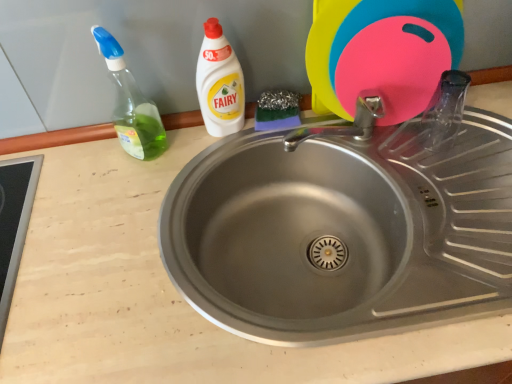
Question: Should I look upward or downward to see stainless steel sink at center?

Choices:
 (A) up
 (B) down

Answer: (B)

Question: Is green translucent bottle at left positioned behind white plastic bottle at upper center?

Choices:
 (A) no
 (B) yes

Answer: (A)

Question: Is green translucent bottle at left located outside white plastic bottle at upper center?

Choices:
 (A) no
 (B) yes

Answer: (B)

Question: Could you tell me if green translucent bottle at left is turned towards white plastic bottle at upper center?

Choices:
 (A) yes
 (B) no

Answer: (B)

Question: Is green translucent bottle at left smaller than white plastic bottle at upper center?

Choices:
 (A) yes
 (B) no

Answer: (B)

Question: Is green translucent bottle at left looking in the opposite direction of white plastic bottle at upper center?

Choices:
 (A) no
 (B) yes

Answer: (A)

Question: Is the depth of green translucent bottle at left less than that of white plastic bottle at upper center?

Choices:
 (A) yes
 (B) no

Answer: (A)

Question: Is stainless steel sink at center outside pink rubber cutting board at upper right?

Choices:
 (A) yes
 (B) no

Answer: (A)

Question: Is stainless steel sink at center taller than pink rubber cutting board at upper right?

Choices:
 (A) yes
 (B) no

Answer: (B)

Question: Is stainless steel sink at center behind pink rubber cutting board at upper right?

Choices:
 (A) no
 (B) yes

Answer: (A)

Question: Are stainless steel sink at center and pink rubber cutting board at upper right located far from each other?

Choices:
 (A) yes
 (B) no

Answer: (B)

Question: From the image's perspective, is stainless steel sink at center under pink rubber cutting board at upper right?

Choices:
 (A) yes
 (B) no

Answer: (A)

Question: Could pink rubber cutting board at upper right be considered to be inside stainless steel sink at center?

Choices:
 (A) yes
 (B) no

Answer: (B)

Question: Is white plastic bottle at upper center located outside stainless steel sink at center?

Choices:
 (A) no
 (B) yes

Answer: (B)